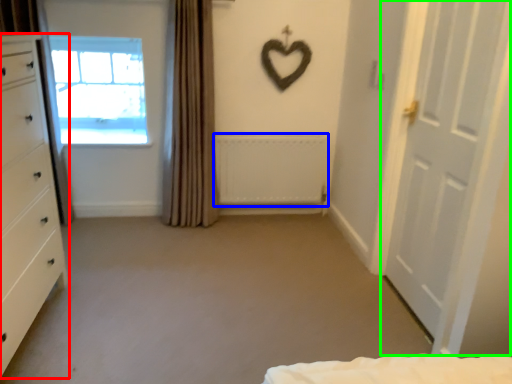
Question: Which object is positioned farthest from chest of drawers (highlighted by a red box)? Select from radiator (highlighted by a blue box) and door (highlighted by a green box).

Choices:
 (A) radiator
 (B) door

Answer: (B)